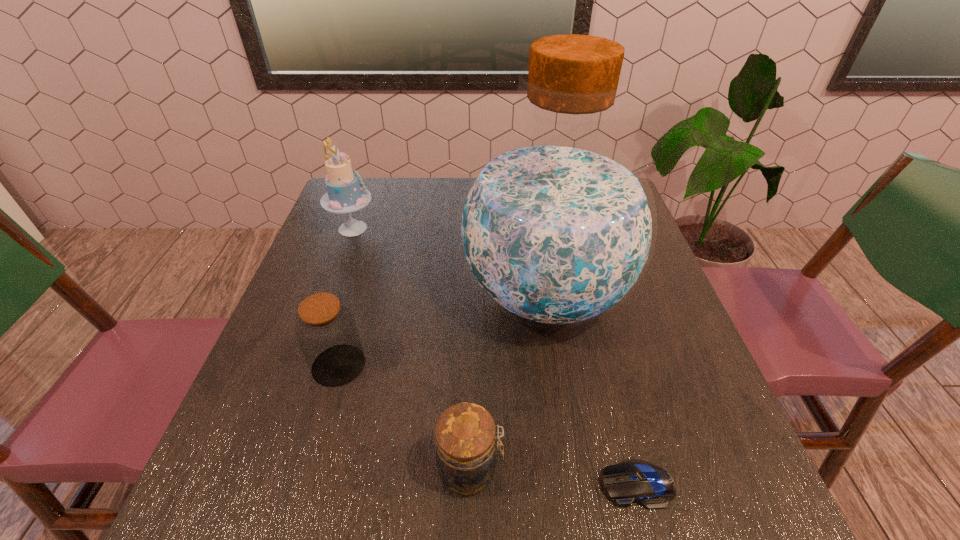
The width and height of the screenshot is (960, 540). What are the coordinates of `vacant space located on the back of the third shortest object` in the screenshot? It's located at (372, 251).

Locate an element on the screen. free point located on the lid of the second shortest object is located at coordinates (612, 469).

I want to click on vacant area situated 0.230m on the button side of the shortest object, so click(x=457, y=484).

Locate an element on the screen. This screenshot has height=540, width=960. free point located 0.130m on the button side of the shortest object is located at coordinates (519, 484).

The height and width of the screenshot is (540, 960). In order to click on free space located 0.300m on the button side of the shortest object in this screenshot , I will do `click(413, 484)`.

Locate an element on the screen. This screenshot has width=960, height=540. object situated at the far edge is located at coordinates (345, 194).

Where is `jar that is at the near edge`? The image size is (960, 540). jar that is at the near edge is located at coordinates (465, 435).

Where is `computer mouse located in the near edge section of the desktop`? The height and width of the screenshot is (540, 960). computer mouse located in the near edge section of the desktop is located at coordinates (631, 481).

The height and width of the screenshot is (540, 960). I want to click on cake that is at the left edge, so click(345, 194).

Identify the location of jar located at the left edge. (326, 330).